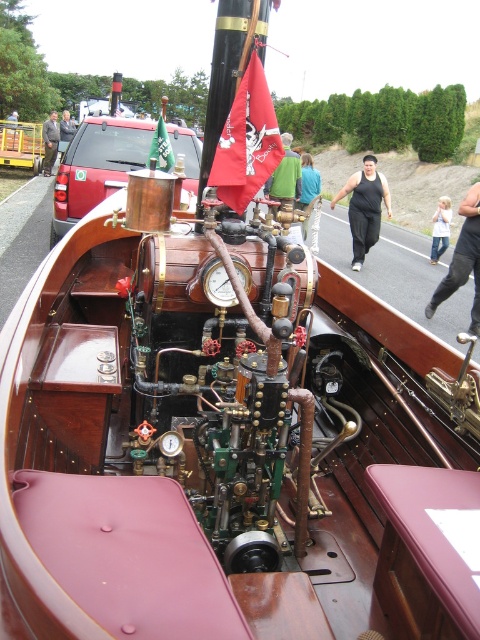
You are a mechanic working on the vintage steamboat. You need to access both the point at coordinates point (x=374, y=172) and point (x=9, y=122). Which point should you reach first if you want to work on the one closer to you?

Point (x=9, y=122) is closer to you, so you should reach it first.

You are a mechanic working on the vintage steamboat. You need to reach the matte brass gauge at center to perform maintenance. If your arm can extend 2.5 feet, can you comfortably reach it?

The matte brass gauge at center is 7.35 feet away from the viewer. Since your arm can only extend 2.5 feet, you cannot comfortably reach it without moving closer.